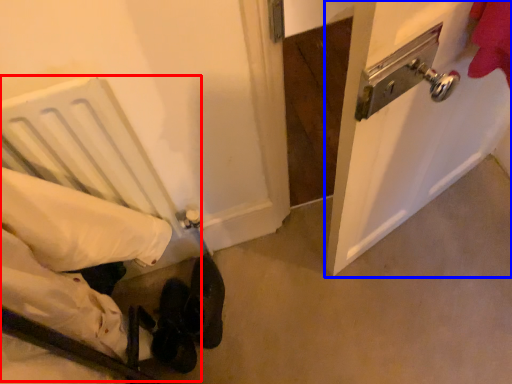
Question: Which object is further to the camera taking this photo, bed (highlighted by a red box) or door (highlighted by a blue box)?

Choices:
 (A) bed
 (B) door

Answer: (B)